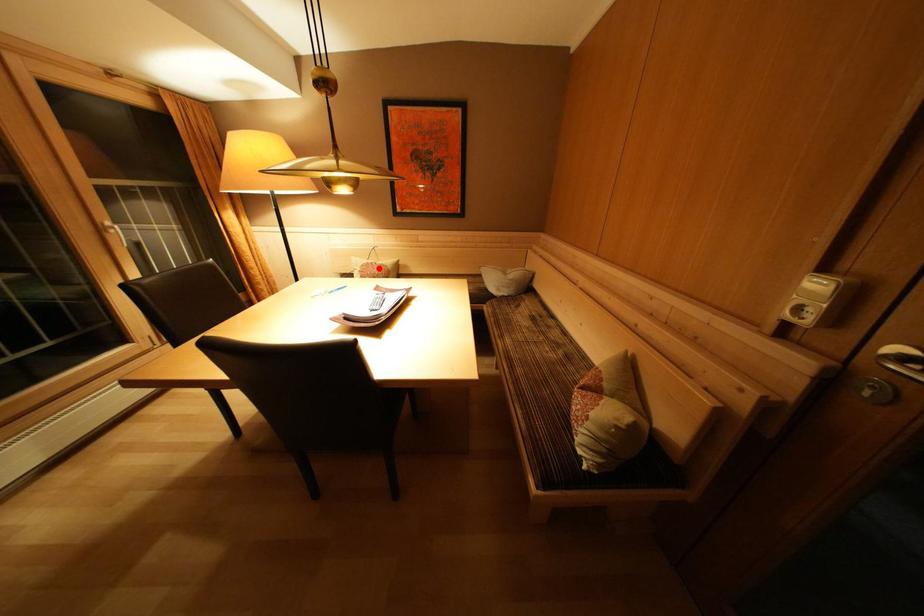
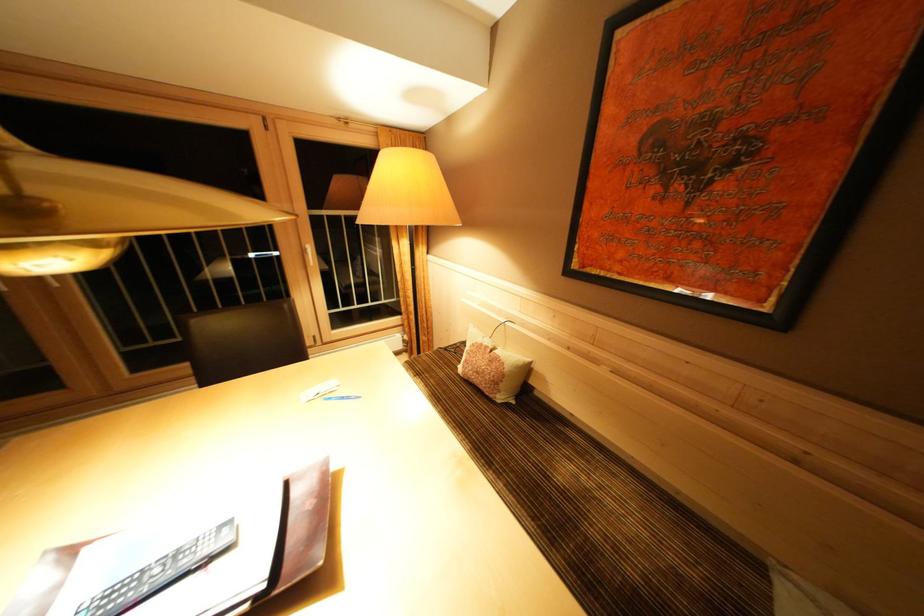
Question: A red point is marked in image1. In image2, is the corresponding 3D point closer to the camera or farther? Reply with the corresponding letter.

Choices:
 (A) The corresponding 3D point is closer.
 (B) The corresponding 3D point is farther.

Answer: (B)